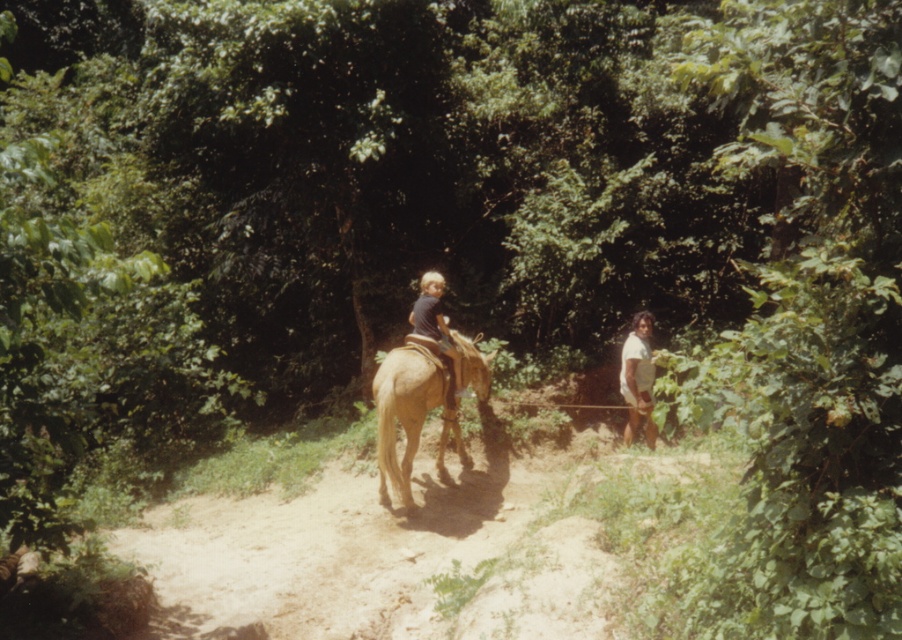
Question: Is light brown smooth horse at center smaller than light brown horse at center?

Choices:
 (A) no
 (B) yes

Answer: (A)

Question: Is light brown smooth horse at center below white matte shirt at right?

Choices:
 (A) yes
 (B) no

Answer: (A)

Question: Which point is closer to the camera taking this photo?

Choices:
 (A) (388, 392)
 (B) (650, 445)

Answer: (A)

Question: Is white matte shirt at right bigger than light brown horse at center?

Choices:
 (A) no
 (B) yes

Answer: (A)

Question: Which point appears farthest from the camera in this image?

Choices:
 (A) (393, 483)
 (B) (454, 380)

Answer: (B)

Question: Which object is farther from the camera taking this photo?

Choices:
 (A) light brown horse at center
 (B) light brown smooth horse at center
 (C) white matte shirt at right

Answer: (C)